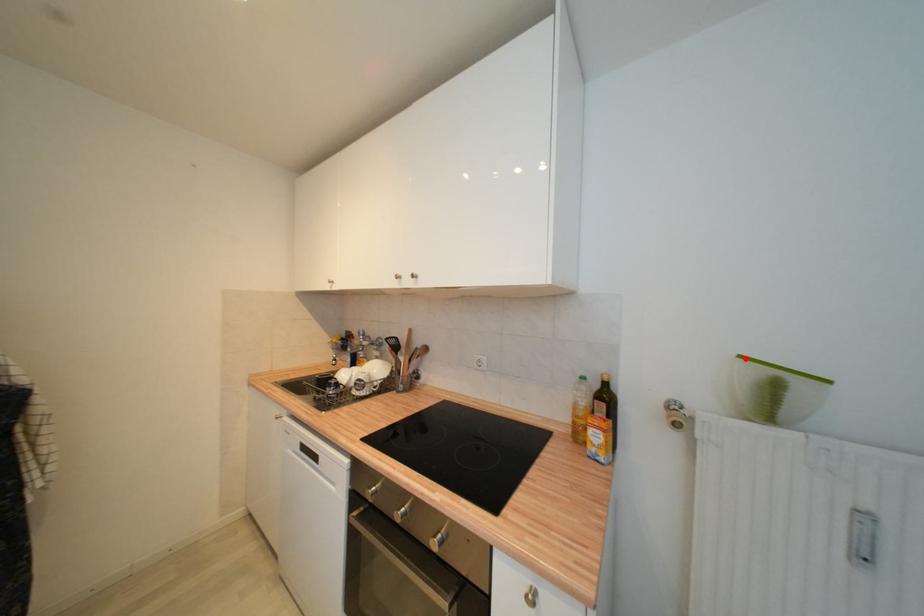
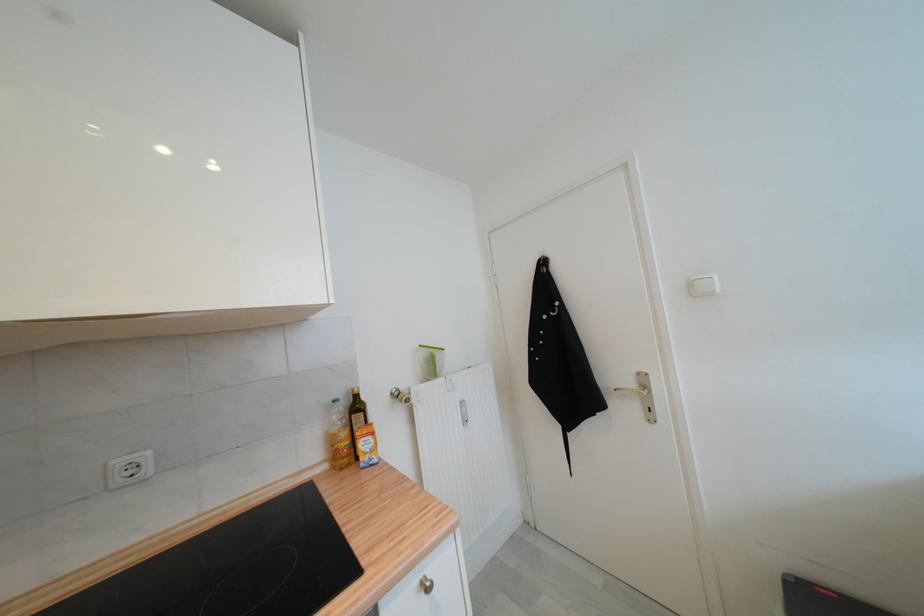
Where in the second image is the point corresponding to the highlighted location from the first image?

(426, 347)